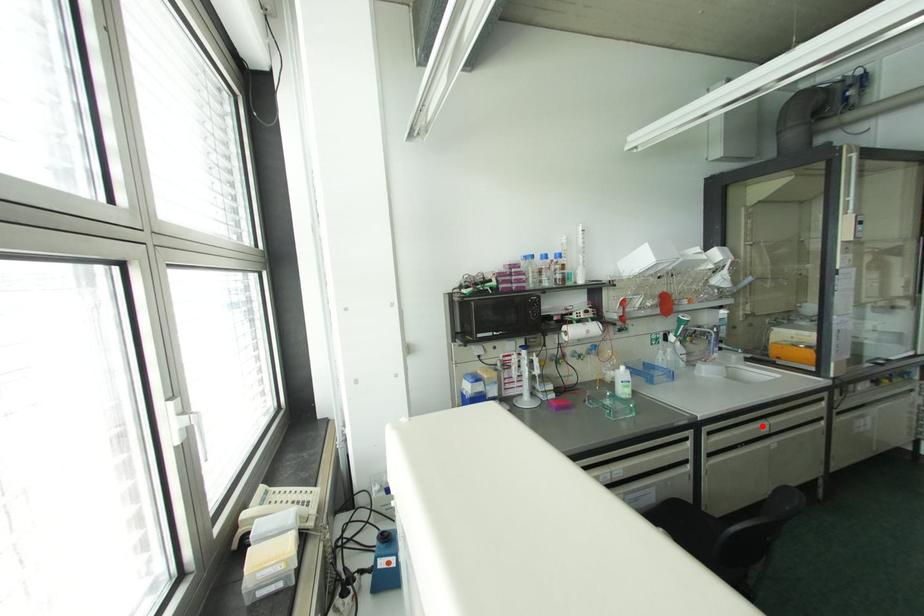
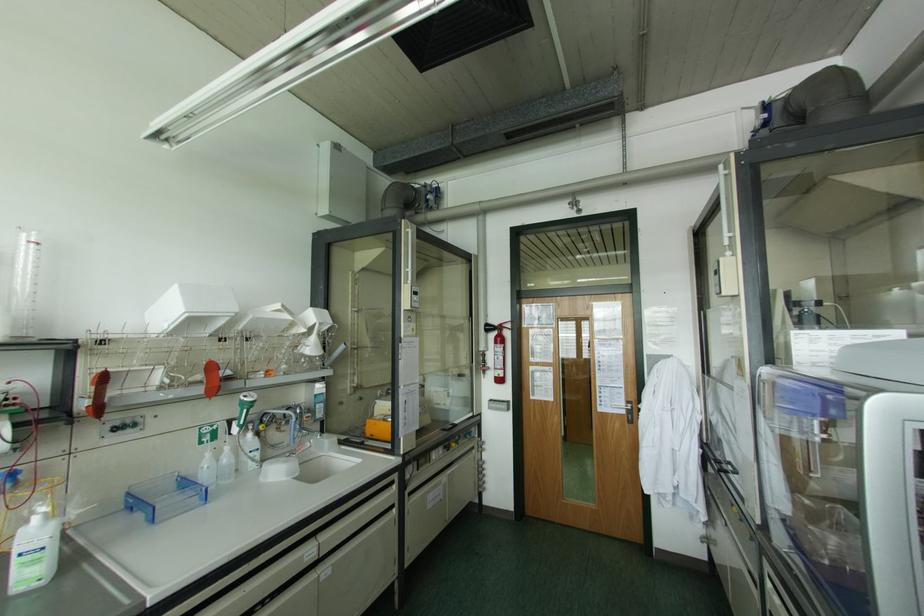
In the second image, find the point that corresponds to the highlighted location in the first image.

(308, 552)